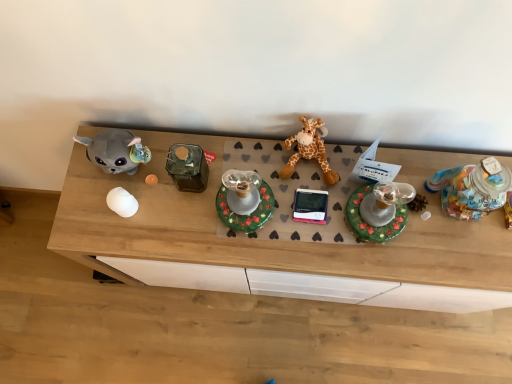
Locate an element on the screen. This screenshot has height=384, width=512. free spot in front of white glossy egg at center, which is the first toy from left to right is located at coordinates (126, 240).